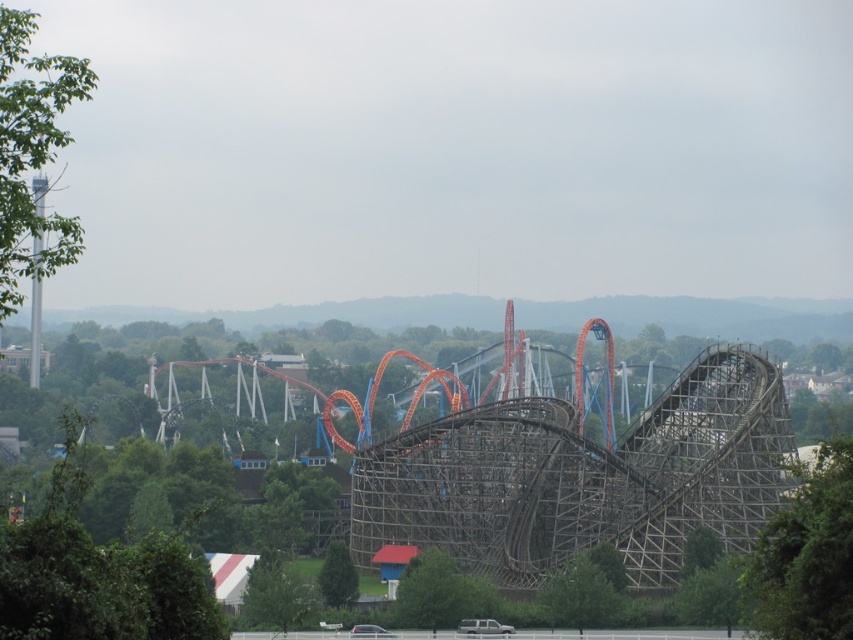
Who is higher up, green leafy tree at lower center or green leafy tree at lower left?

Positioned higher is green leafy tree at lower center.

Is point (578, 596) positioned before point (242, 612)?

Yes, it is in front of point (242, 612).

Locate an element on the screen. Image resolution: width=853 pixels, height=640 pixels. green leafy tree at lower center is located at coordinates (585, 589).

Image resolution: width=853 pixels, height=640 pixels. I want to click on green leafy tree at left, so click(x=32, y=150).

Which is behind, point (21, 131) or point (817, 465)?

The point (817, 465) is more distant.

Is point (18, 99) positioned behind point (811, 536)?

No, (18, 99) is closer to viewer.

You are a GUI agent. You are given a task and a screenshot of the screen. Output one action in this format:
    pyautogui.click(x=<x>, y=<y>)
    Task: Click on the green leafy tree at left
    Image resolution: width=853 pixels, height=640 pixels.
    Given the screenshot: What is the action you would take?
    pyautogui.click(x=32, y=150)

Between green leafy tree at lower left and green matte tree at lower center, which one has more height?

Standing taller between the two is green leafy tree at lower left.

Is point (294, 616) in front of point (328, 557)?

Yes.

Which is behind, point (252, 577) or point (340, 577)?

The point (340, 577) is behind.

You are a GUI agent. You are given a task and a screenshot of the screen. Output one action in this format:
    pyautogui.click(x=<x>, y=<y>)
    Task: Click on the green leafy tree at lower left
    The height and width of the screenshot is (640, 853).
    Given the screenshot: What is the action you would take?
    pyautogui.click(x=276, y=593)